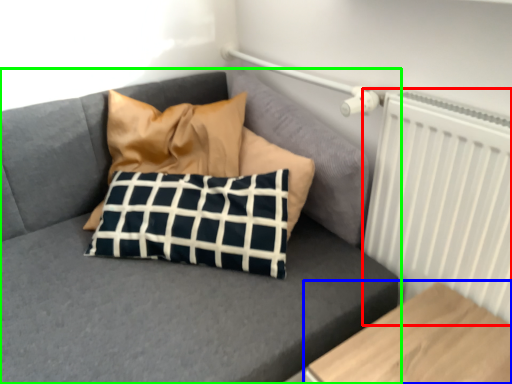
Question: Which is nearer to the radiator (highlighted by a red box)? furniture (highlighted by a blue box) or studio couch (highlighted by a green box).

Choices:
 (A) furniture
 (B) studio couch

Answer: (A)